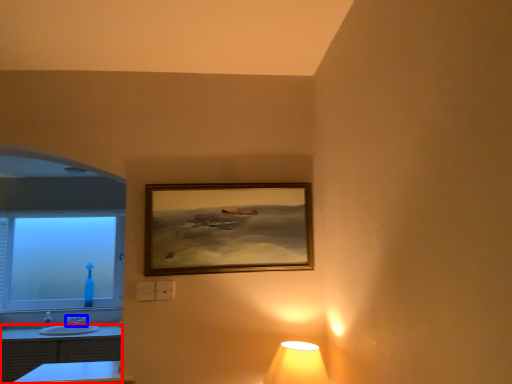
Question: Which object appears farthest to the camera in this image, dresser (highlighted by a red box) or tap (highlighted by a blue box)?

Choices:
 (A) dresser
 (B) tap

Answer: (B)